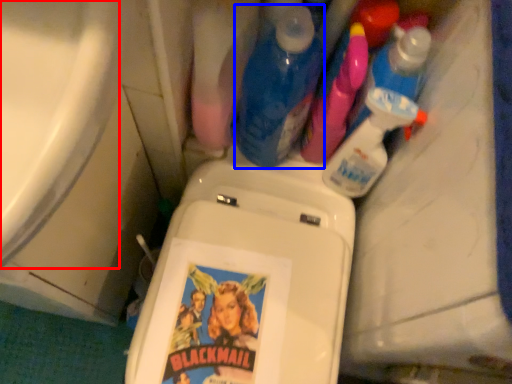
Question: Which of the following is the farthest to the observer, bath (highlighted by a red box) or cleaning product (highlighted by a blue box)?

Choices:
 (A) bath
 (B) cleaning product

Answer: (B)